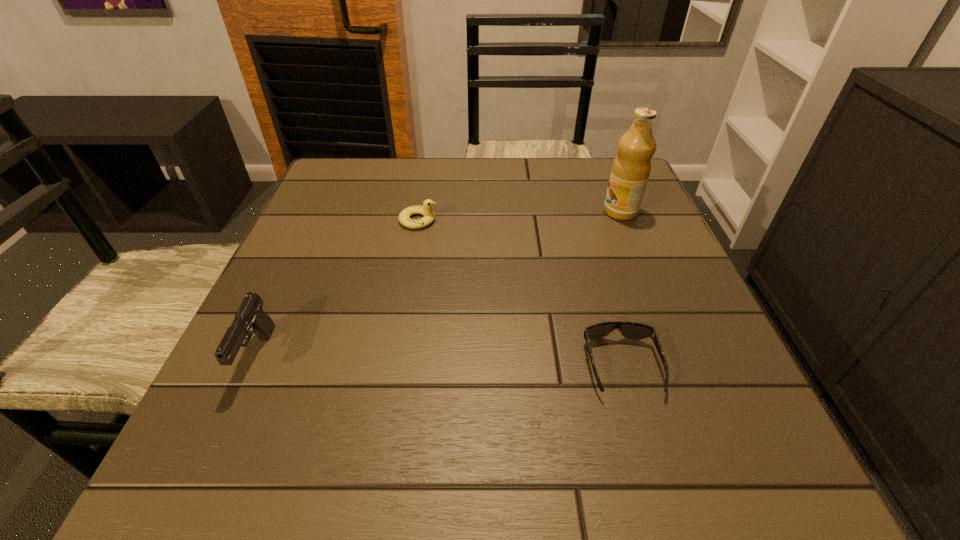
At what (x,y) coordinates should I click in order to perform the action: click on empty location between the shortest object and the olive oil. Please return your answer as a coordinate pair (x, y). Looking at the image, I should click on (621, 289).

Find the location of `blank region between the tallest object and the shortest object`. blank region between the tallest object and the shortest object is located at coordinates (621, 289).

I want to click on vacant area between the sunglasses and the leftmost object, so click(440, 361).

Identify the location of vacant area that lies between the pistol and the olive oil. This screenshot has width=960, height=540. (440, 284).

Locate an element on the screen. The width and height of the screenshot is (960, 540). the third closest object to the shortest object is located at coordinates coord(250,318).

Find the location of a particular element. object that is the second closest to the pistol is located at coordinates (632, 330).

The height and width of the screenshot is (540, 960). What are the coordinates of `vacant space that satisfies the following two spatial constraints: 1. on the label of the olive oil; 2. aim along the barrel of the pistol` in the screenshot? It's located at (679, 356).

You are a GUI agent. You are given a task and a screenshot of the screen. Output one action in this format:
    pyautogui.click(x=<x>, y=<y>)
    Task: Click on the vacant space that satisfies the following two spatial constraints: 1. on the face of the third tallest object; 2. aim along the barrel of the leftmost object
    
    Given the screenshot: What is the action you would take?
    pyautogui.click(x=396, y=356)

This screenshot has width=960, height=540. I want to click on free space that satisfies the following two spatial constraints: 1. on the label of the tallest object; 2. aim along the barrel of the leftmost object, so click(679, 356).

The height and width of the screenshot is (540, 960). What are the coordinates of `vacant space that satisfies the following two spatial constraints: 1. on the face of the duckling; 2. aim along the barrel of the leftmost object` in the screenshot? It's located at (396, 356).